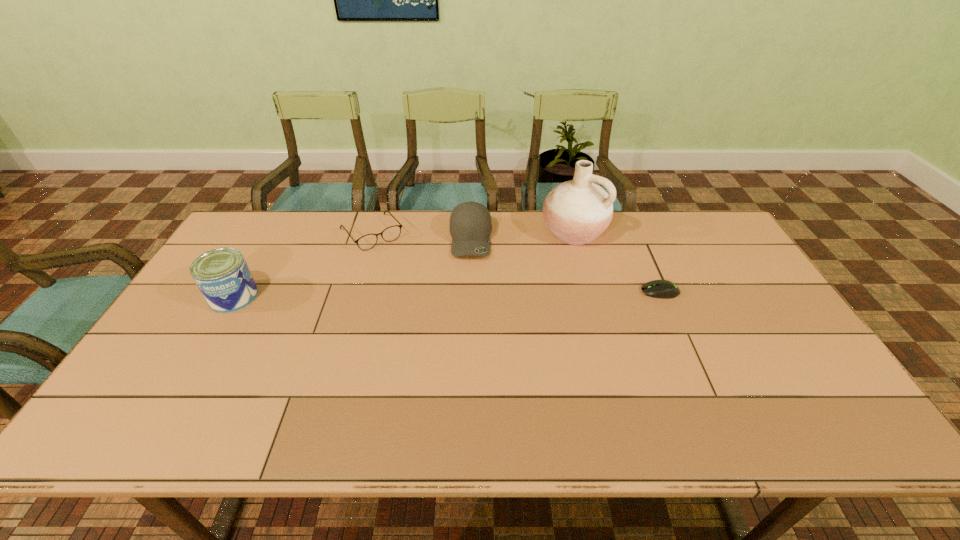
Identify the location of free spot between the leftmost object and the rightmost object. (446, 294).

Where is `empty space that is in between the computer mouse and the leftmost object`? The height and width of the screenshot is (540, 960). empty space that is in between the computer mouse and the leftmost object is located at coordinates (446, 294).

Identify the location of free spot between the computer mouse and the leftmost object. Image resolution: width=960 pixels, height=540 pixels. (446, 294).

The height and width of the screenshot is (540, 960). Find the location of `free space between the tallest object and the can`. free space between the tallest object and the can is located at coordinates (x=404, y=264).

The image size is (960, 540). Identify the location of vacant point located between the fourth tallest object and the baseball cap. tap(421, 236).

Where is `vacant space that's between the baseball cap and the second object from left to right`? vacant space that's between the baseball cap and the second object from left to right is located at coordinates pos(421,236).

You are a GUI agent. You are given a task and a screenshot of the screen. Output one action in this format:
    pyautogui.click(x=<x>, y=<y>)
    Task: Click on the vacant region between the can and the third object from left to right
    The image size is (960, 540).
    Given the screenshot: What is the action you would take?
    pyautogui.click(x=352, y=268)

Identify the location of object that is the closest to the rightmost object. The height and width of the screenshot is (540, 960). (578, 211).

Select which object is the second closest to the pottery. Please provide its 2D coordinates. Your answer should be formatted as a tuple, i.e. [(x, y)], where the tuple contains the x and y coordinates of a point satisfying the conditions above.

[(470, 224)]

I want to click on free spot that satisfies the following two spatial constraints: 1. on the front side of the pottery; 2. on the wheel side of the computer mouse, so click(x=590, y=292).